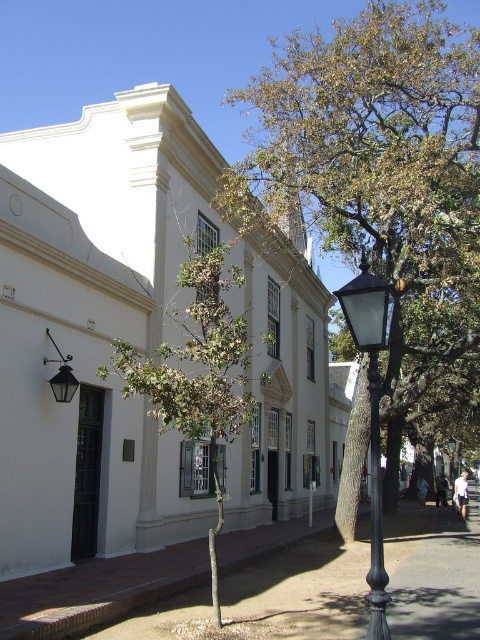
Is black metal pole at center wider than matte black lamp at left?

Incorrect, black metal pole at center's width does not surpass matte black lamp at left's.

Is black metal pole at center above matte black lamp at left?

No.

Does point (372, 400) come behind point (51, 385)?

No, (372, 400) is in front of (51, 385).

You are a GUI agent. You are given a task and a screenshot of the screen. Output one action in this format:
    pyautogui.click(x=<x>, y=<y>)
    Task: Click on the black metal pole at center
    Image resolution: width=480 pixels, height=640 pixels.
    Given the screenshot: What is the action you would take?
    pyautogui.click(x=375, y=516)

Is green leafy tree at center wider than black metal pole at center?

Yes.

The height and width of the screenshot is (640, 480). Describe the element at coordinates (199, 372) in the screenshot. I see `green leafy tree at center` at that location.

Measure the distance between green leafy tree at center and camera.

A distance of 7.40 meters exists between green leafy tree at center and camera.

Locate an element on the screen. The height and width of the screenshot is (640, 480). green leafy tree at center is located at coordinates (199, 372).

Does black glass lamp post at right appear under black metal streetlight at center?

No.

Measure the distance between black glass lamp post at right and black metal streetlight at center.

A distance of 31.27 meters exists between black glass lamp post at right and black metal streetlight at center.

This screenshot has width=480, height=640. What do you see at coordinates (372, 413) in the screenshot?
I see `black glass lamp post at right` at bounding box center [372, 413].

Locate an element on the screen. The width and height of the screenshot is (480, 640). black glass lamp post at right is located at coordinates (372, 413).